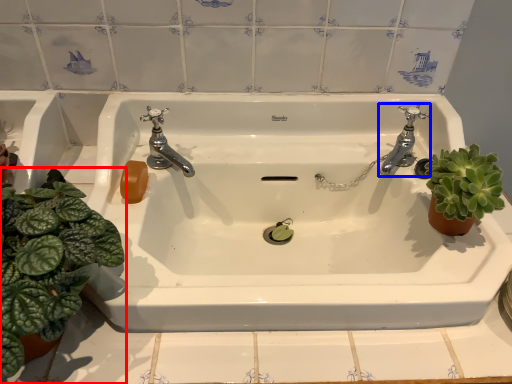
Question: Which object is closer to the camera taking this photo, houseplant (highlighted by a red box) or tap (highlighted by a blue box)?

Choices:
 (A) houseplant
 (B) tap

Answer: (A)